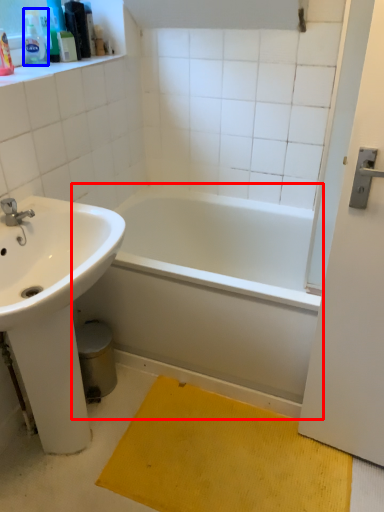
Question: Which object appears closest to the camera in this image, bathtub (highlighted by a red box) or toiletry (highlighted by a blue box)?

Choices:
 (A) bathtub
 (B) toiletry

Answer: (A)